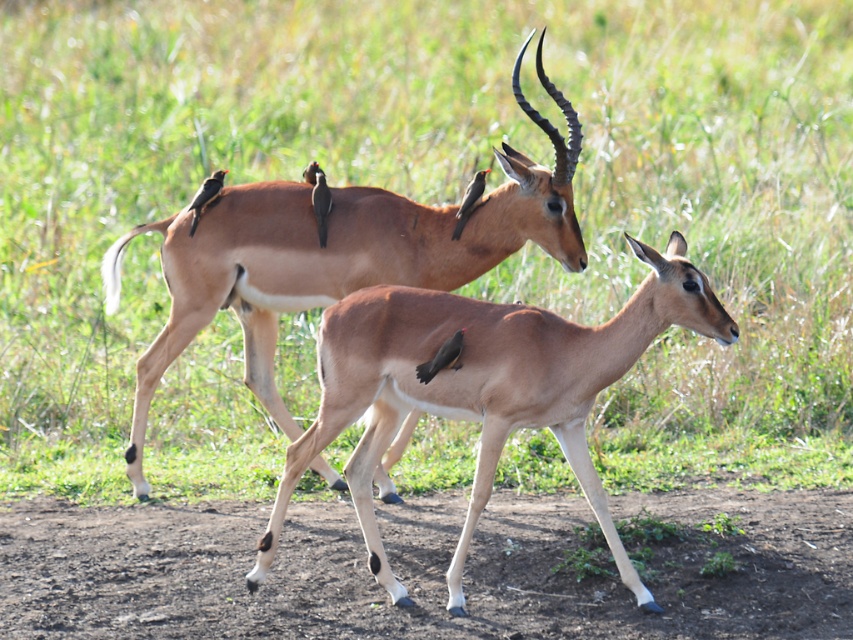
Can you confirm if brown glossy antelope at center is positioned below light brown smooth deer at center?

No.

Describe the element at coordinates (337, 252) in the screenshot. I see `brown glossy antelope at center` at that location.

You are a GUI agent. You are given a task and a screenshot of the screen. Output one action in this format:
    pyautogui.click(x=<x>, y=<y>)
    Task: Click on the brown glossy antelope at center
    Image resolution: width=853 pixels, height=640 pixels.
    Given the screenshot: What is the action you would take?
    pyautogui.click(x=337, y=252)